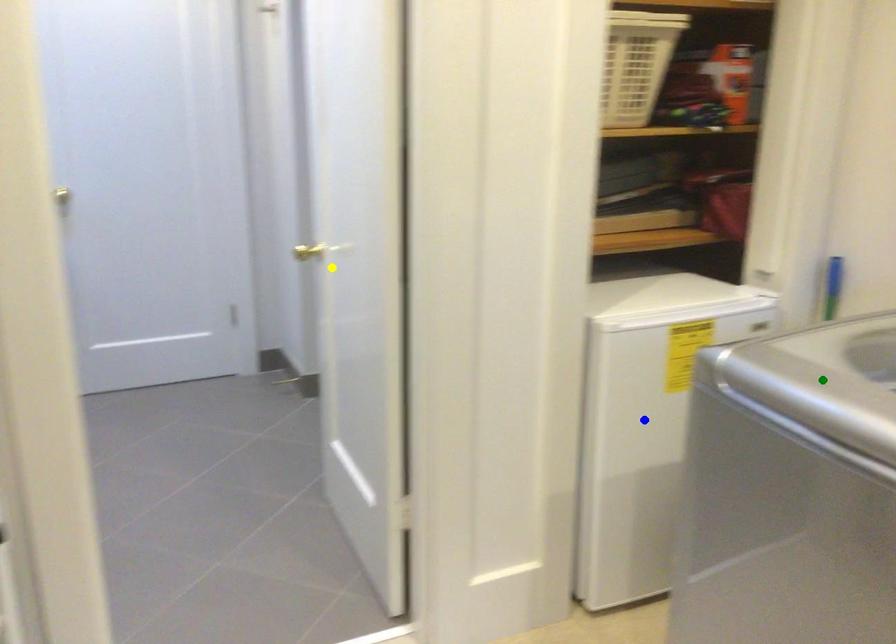
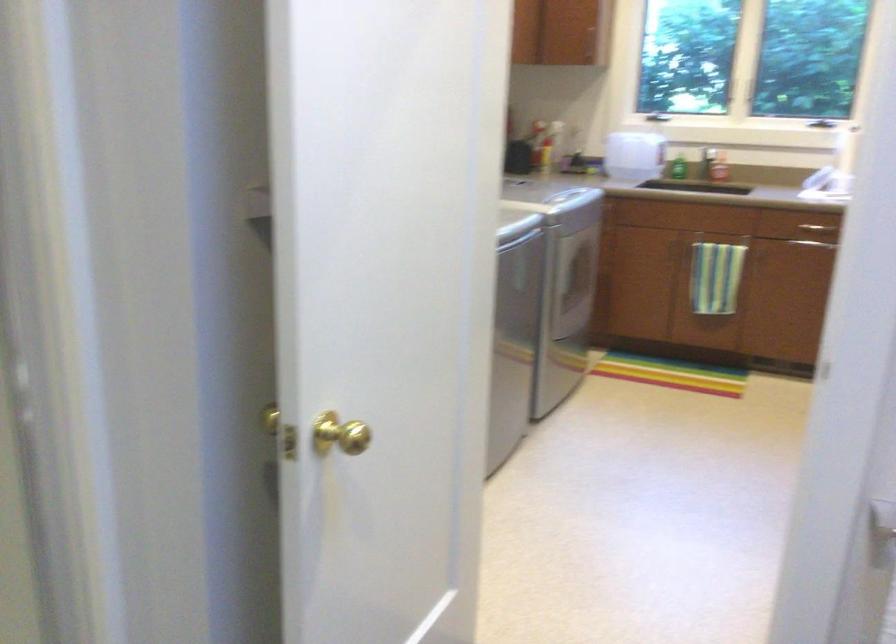
I am providing you with two images of the same scene from different viewpoints. Three points are marked in image1. Which point corresponds to a part or object that is occluded in image2?In image1, three points are marked. Which of them correspond to a part or object that is occluded in image2?Among the three points shown in image1, which one corresponds to a part or object that is no longer visible due to occlusion in image2?

blue point, green point cannot be seen in image2.